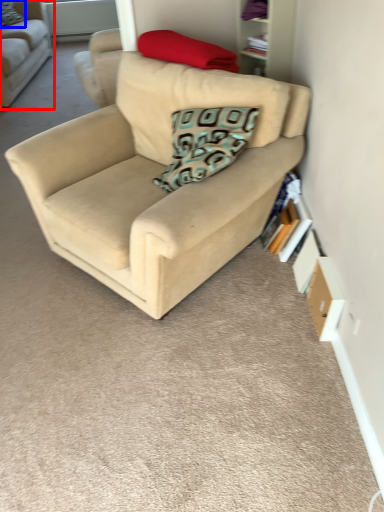
Question: Which object is closer to the camera taking this photo, studio couch (highlighted by a red box) or pillow (highlighted by a blue box)?

Choices:
 (A) studio couch
 (B) pillow

Answer: (A)